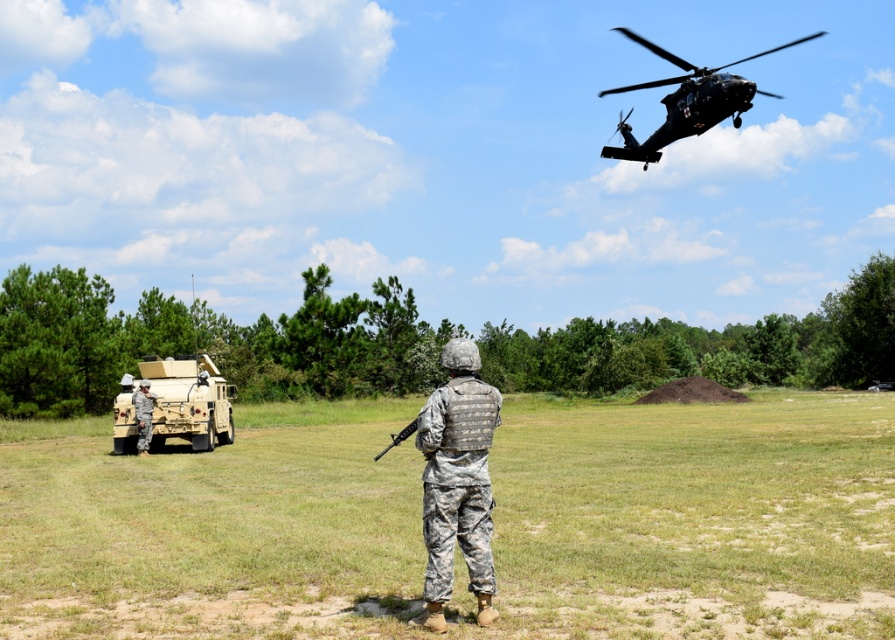
Between camouflage fabric vest at center and black matte helicopter at upper right, which one appears on the right side from the viewer's perspective?

black matte helicopter at upper right

Is camouflage fabric vest at center wider than black matte helicopter at upper right?

No, camouflage fabric vest at center is not wider than black matte helicopter at upper right.

Does point (493, 410) come closer to viewer compared to point (714, 106)?

That is True.

This screenshot has width=895, height=640. In order to click on camouflage fabric vest at center in this screenshot , I will do (x=457, y=483).

Who is more forward, (x=209, y=385) or (x=663, y=134)?

Point (x=663, y=134) is in front.

Does camouflage fabric armored vehicle at lower left have a smaller size compared to black matte helicopter at upper right?

Yes, camouflage fabric armored vehicle at lower left is smaller than black matte helicopter at upper right.

Who is more distant from viewer, (x=203, y=445) or (x=710, y=116)?

Point (x=203, y=445)

At what (x,y) coordinates should I click in order to perform the action: click on camouflage fabric armored vehicle at lower left. Please return your answer as a coordinate pair (x, y). The height and width of the screenshot is (640, 895). Looking at the image, I should click on (189, 401).

Who is positioned more to the left, camouflage fabric armored vehicle at lower left or camouflage fabric rifle at center?

camouflage fabric armored vehicle at lower left is more to the left.

Is camouflage fabric armored vehicle at lower left taller than camouflage fabric rifle at center?

No.

Is point (166, 410) in front of point (388, 449)?

No, (166, 410) is behind (388, 449).

Identify the location of camouflage fabric armored vehicle at lower left. (189, 401).